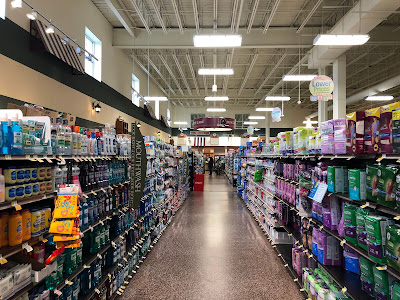
Identify the location of floor. (225, 252).